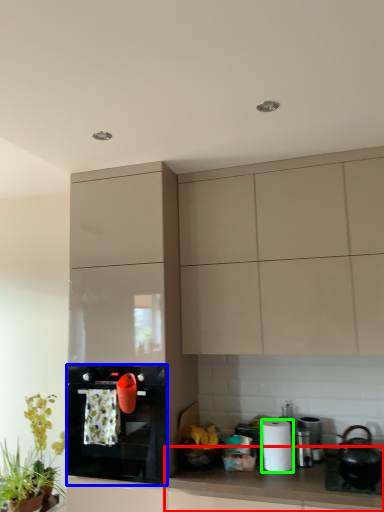
Question: Which object is the farthest from countertop (highlighted by a red box)? Choose among these: kitchen appliance (highlighted by a blue box) or paper towel (highlighted by a green box).

Choices:
 (A) kitchen appliance
 (B) paper towel

Answer: (A)